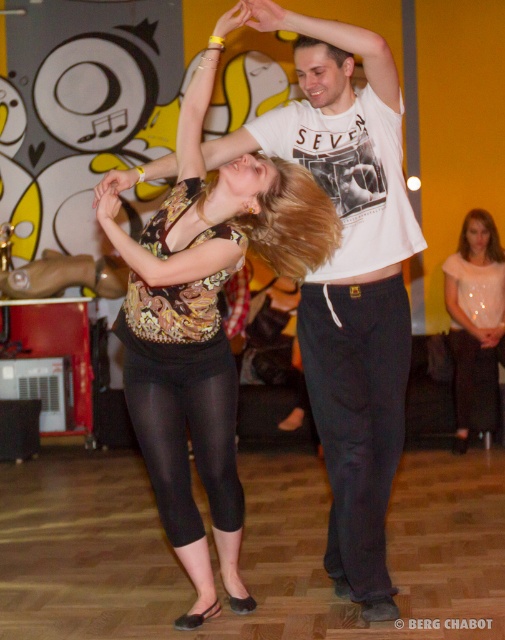
Question: Is matte black leggings at center to the left of matte white blouse at lower right from the viewer's perspective?

Choices:
 (A) no
 (B) yes

Answer: (B)

Question: Is matte black leggings at center to the right of matte white blouse at lower right from the viewer's perspective?

Choices:
 (A) yes
 (B) no

Answer: (B)

Question: Which point is closer to the camera?

Choices:
 (A) (140, 403)
 (B) (469, 342)

Answer: (A)

Question: Is matte black leggings at center to the right of matte white blouse at lower right from the viewer's perspective?

Choices:
 (A) no
 (B) yes

Answer: (A)

Question: Which point is closer to the camera taking this photo?

Choices:
 (A) click(227, 204)
 (B) click(485, 332)

Answer: (A)